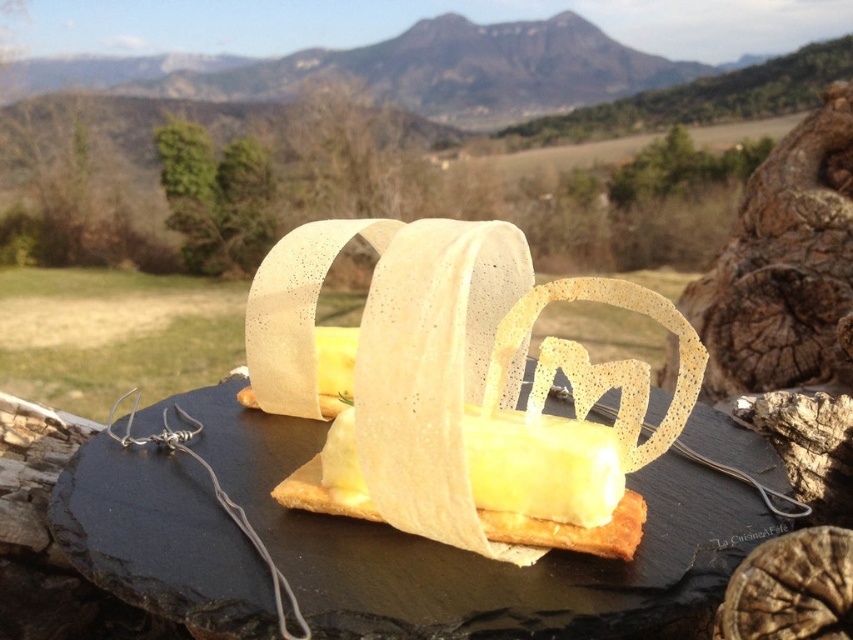
Between translucent paper crown at center and rough bark tree trunk at right, which one appears on the left side from the viewer's perspective?

translucent paper crown at center

The image size is (853, 640). Describe the element at coordinates (456, 387) in the screenshot. I see `translucent paper crown at center` at that location.

Image resolution: width=853 pixels, height=640 pixels. I want to click on translucent paper crown at center, so (x=456, y=387).